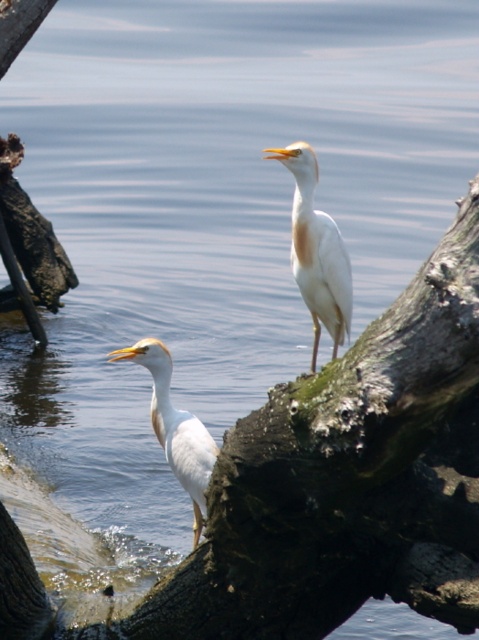
Where is `white matte bird at center`? white matte bird at center is located at coordinates (317, 250).

Is point (337, 246) farther from viewer compared to point (155, 353)?

Yes, point (337, 246) is behind point (155, 353).

Image resolution: width=479 pixels, height=640 pixels. In order to click on white matte bird at center in this screenshot , I will do `click(317, 250)`.